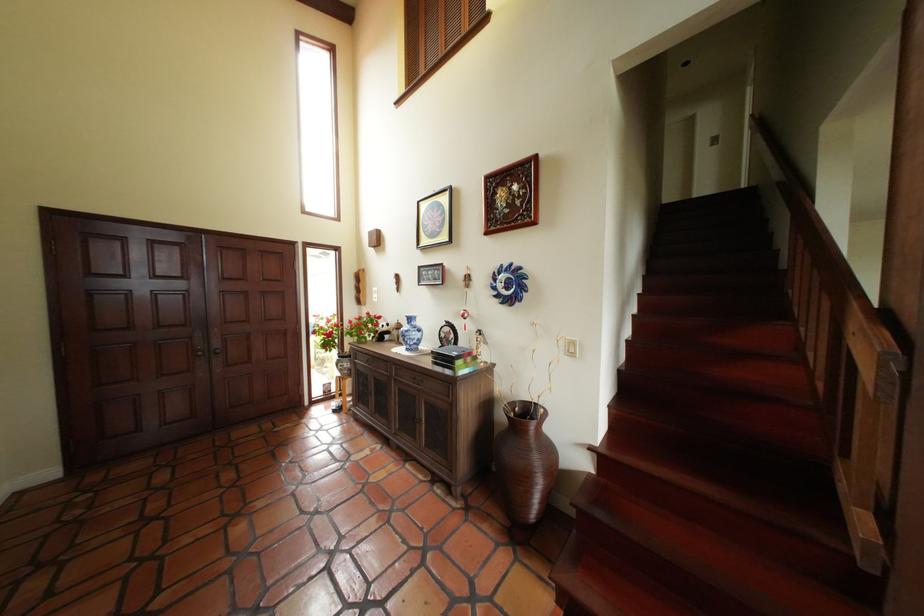
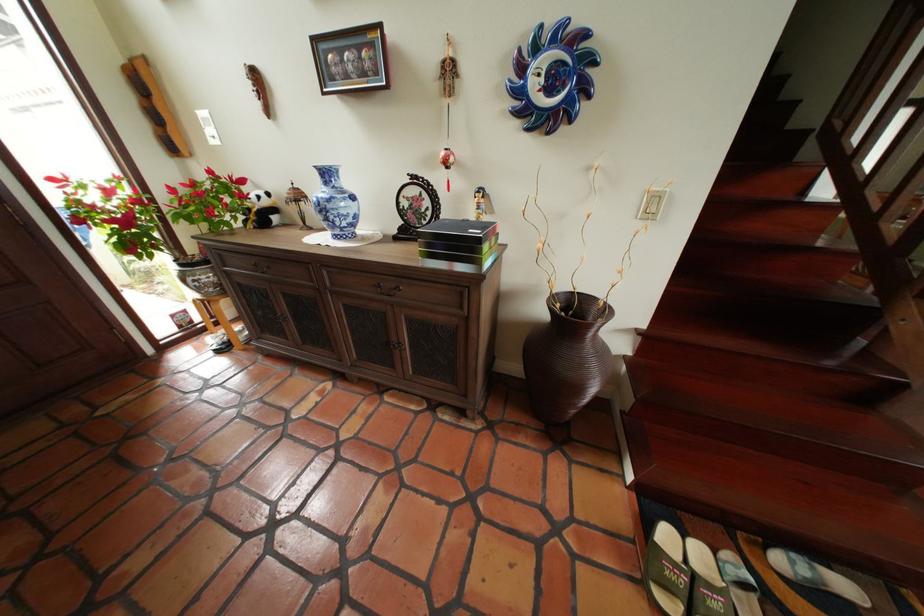
How did the camera likely rotate?

The camera's rotation is toward right-down.